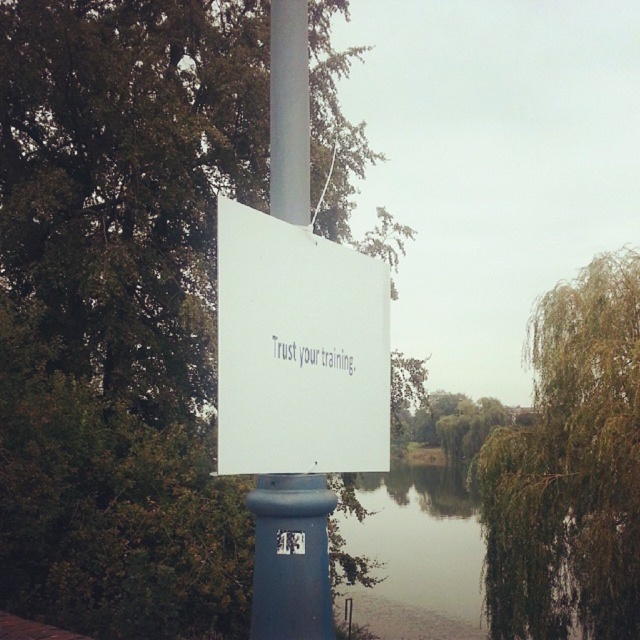
Question: Which object appears farthest from the camera in this image?

Choices:
 (A) green leafy tree at upper left
 (B) white plastic sign at center

Answer: (A)

Question: Which is farther from the white paper sign at center?

Choices:
 (A) green leafy tree at right
 (B) green leafy tree at center
 (C) white plastic sign at center
 (D) green leafy tree at upper left

Answer: (B)

Question: Considering the relative positions of white plastic sign at center and green leafy tree at center in the image provided, where is white plastic sign at center located with respect to green leafy tree at center?

Choices:
 (A) left
 (B) right

Answer: (A)

Question: Does green leafy tree at right have a lesser width compared to white plastic sign at center?

Choices:
 (A) yes
 (B) no

Answer: (B)

Question: Which object is farther from the camera taking this photo?

Choices:
 (A) green leafy tree at right
 (B) green leafy tree at center

Answer: (B)

Question: Does green leafy tree at upper left have a greater width compared to green leafy tree at center?

Choices:
 (A) yes
 (B) no

Answer: (A)